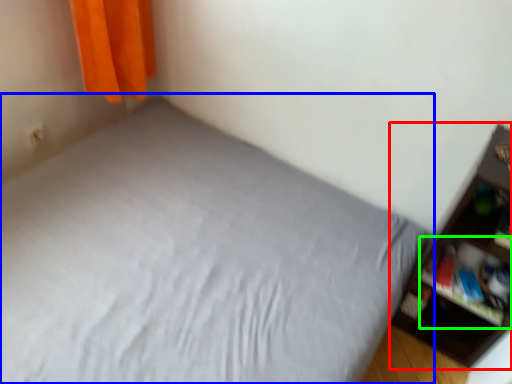
Question: Which object is positioned closest to shelf (highlighted by a red box)? Select from bed (highlighted by a blue box) and cabinet (highlighted by a green box).

Choices:
 (A) bed
 (B) cabinet

Answer: (B)